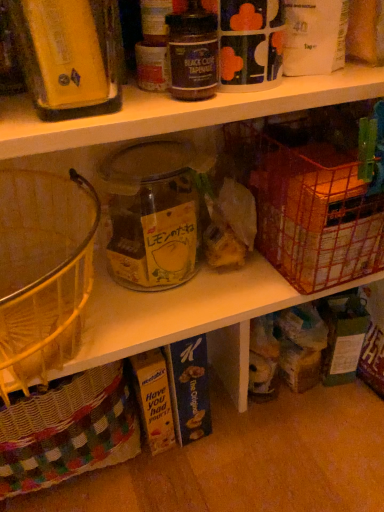
Find the location of a particular element. This screenshot has height=512, width=384. vacant area that lies to the right of black glass jar at upper center, the 1th bottle when ordered from right to left is located at coordinates (302, 82).